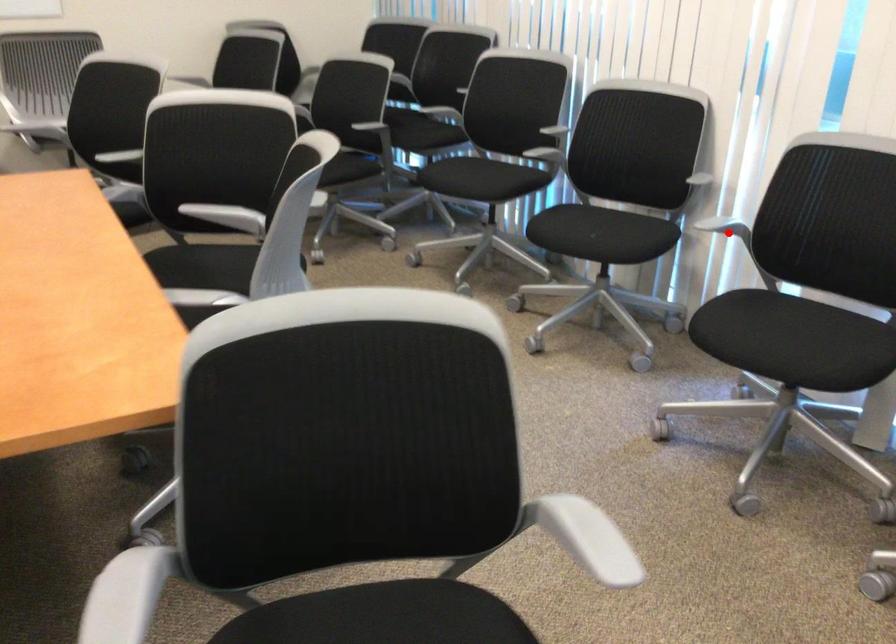
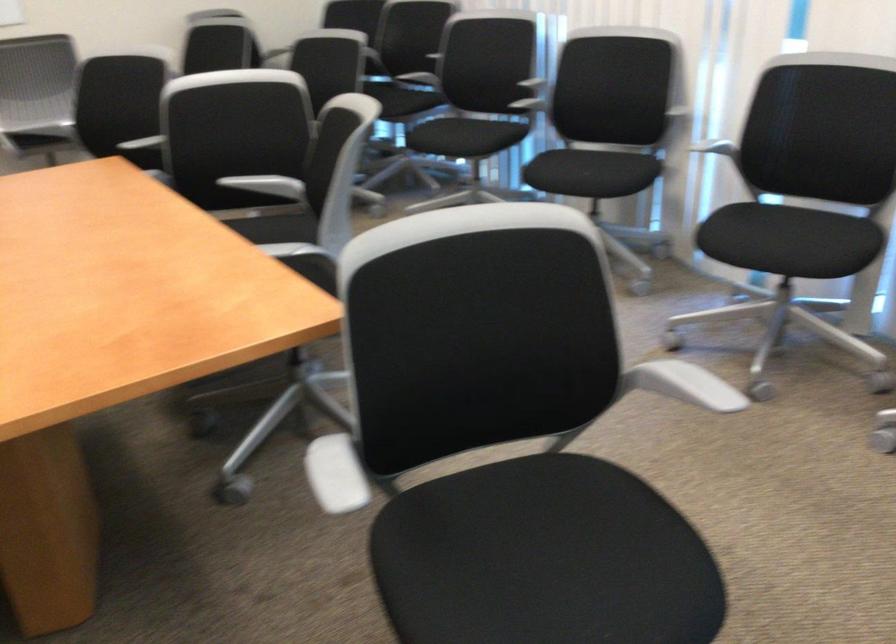
Find the pixel in the second image that matches the highlighted location in the first image.

(718, 149)